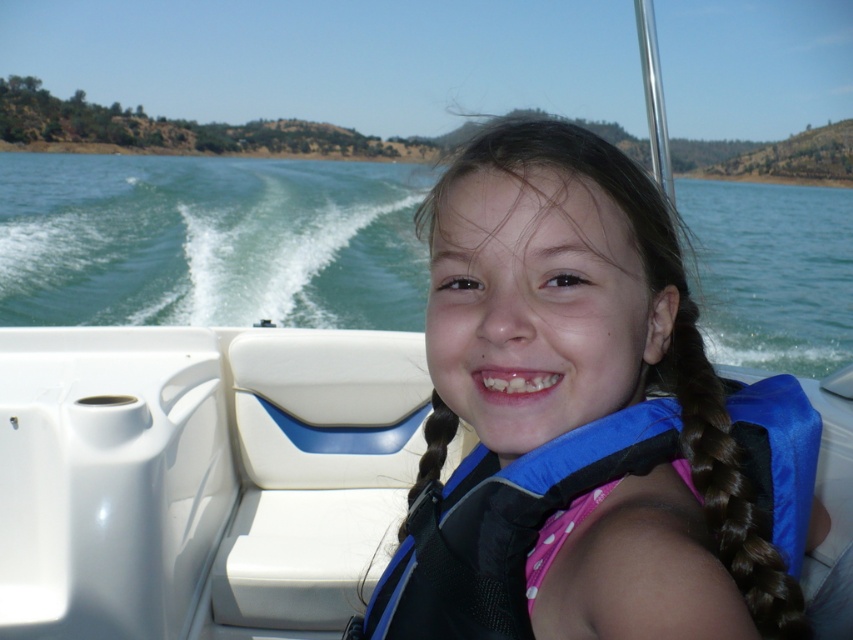
You are a safety officer assessing the safety of the boat ride. The safety regulations state that the distance between the water and the passenger must be at least 10 meters to prevent accidental falls. Based on the image, is the current distance between the blue water at center and brown silky hair at center compliant with the safety regulations?

The blue water at center is 8.16 meters away from brown silky hair at center, which is less than the required 10 meters. Therefore, the current distance does not comply with the safety regulations.

From the picture: You are a safety inspector checking the boat for safety compliance. The boat must be fully visible above the water for inspection. Based on the scene, is the white plastic boat at center fully visible above the blue water at center?

The blue water at center is behind the white plastic boat at center, so the boat is fully visible above the water as required.